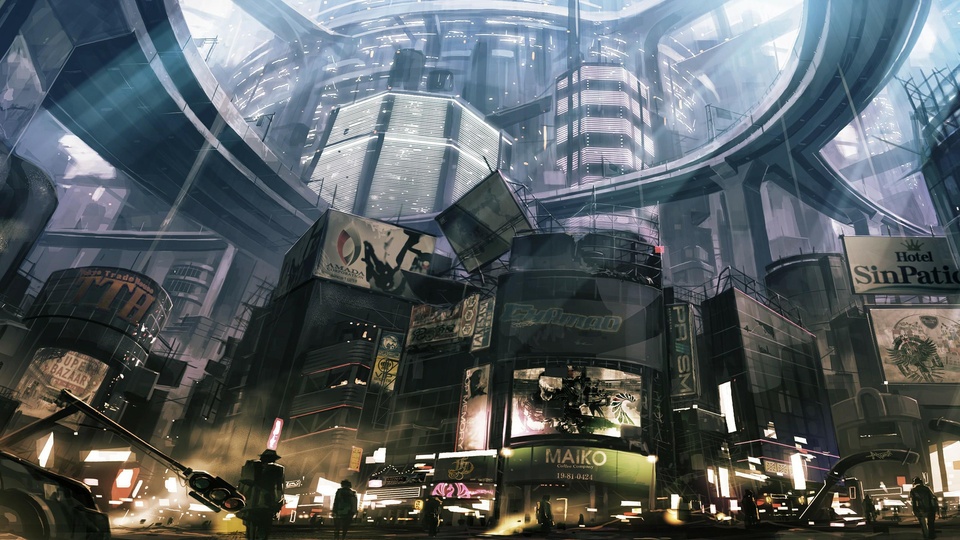
Identify the location of clear ceiling. (707, 9).